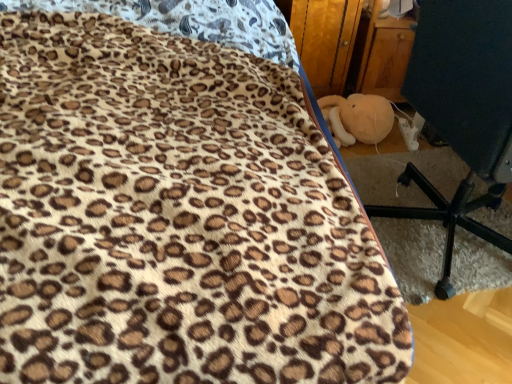
This screenshot has width=512, height=384. Identify the location of vacant area situated below black plastic chair at lower right (from a real-world perspective). (442, 235).